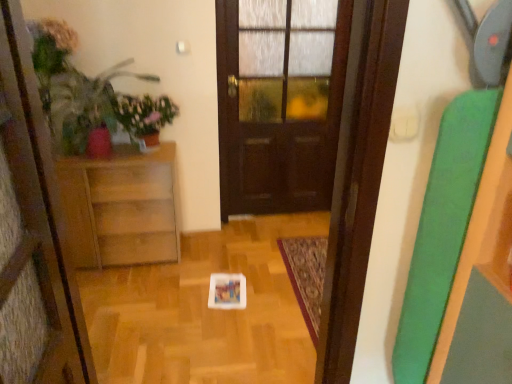
The height and width of the screenshot is (384, 512). In order to click on free location to the right of wooden cabinet at left in this screenshot , I will do `click(211, 258)`.